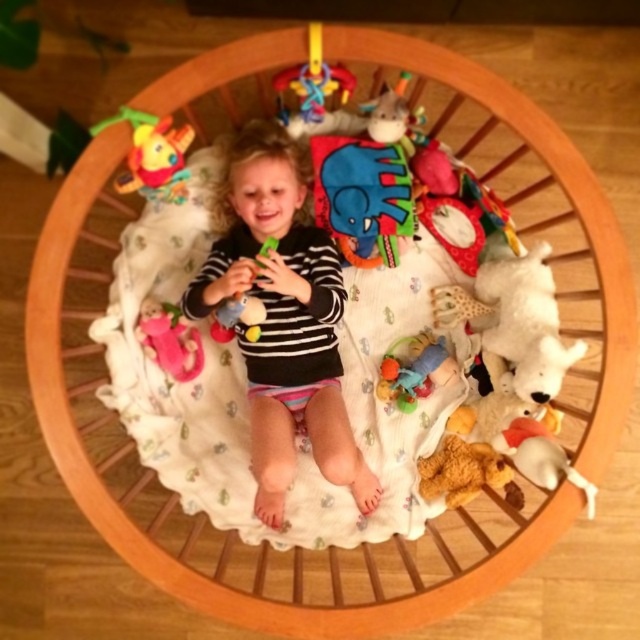
You are a parent looking at the playpen and want to retrieve the white plush toy at lower right for your child. Can you reach it without moving the plush yellow duck at upper left?

The plush yellow duck at upper left is positioned over the white plush toy at lower right, so you cannot reach the white plush toy at lower right without moving the plush yellow duck at upper left.

You are a parent trying to place a new toy inside the playpen. The playpen has limited space. Which object, the black striped shirt at center or the blue felt elephant at center, takes up more horizontal space?

The black striped shirt at center takes up more horizontal space than the blue felt elephant at center because its width surpasses the elephant.

In the scene described, where is the black striped shirt at center in relation to the blue felt elephant at center?

The black striped shirt at center is to the left of the blue felt elephant at center.